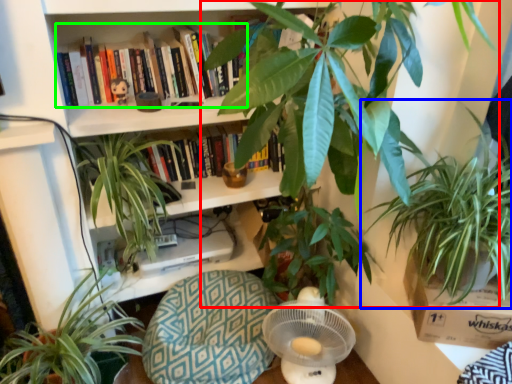
Question: Based on their relative distances, which object is farther from houseplant (highlighted by a red box)? Choose from houseplant (highlighted by a blue box) and book (highlighted by a green box).

Choices:
 (A) houseplant
 (B) book

Answer: (B)